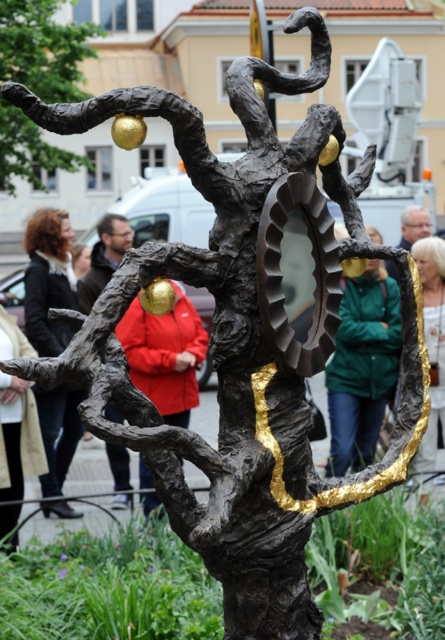
Question: Can you confirm if black leather jacket at left is thinner than gold polished sphere at center?

Choices:
 (A) no
 (B) yes

Answer: (A)

Question: Is golden metallic hair at upper right further to camera compared to gold metallic sphere at upper center?

Choices:
 (A) no
 (B) yes

Answer: (B)

Question: Which object is closer to the camera taking this photo?

Choices:
 (A) bronze textured tree at upper left
 (B) gold metallic sphere at upper center

Answer: (B)

Question: Does golden metallic hair at upper right have a larger size compared to gold polished sphere at center?

Choices:
 (A) no
 (B) yes

Answer: (B)

Question: Which point is farther from the camera taking this photo?

Choices:
 (A) (372, 372)
 (B) (31, 180)
 (C) (161, 282)

Answer: (B)

Question: Which object is closer to the camera taking this photo?

Choices:
 (A) black leather jacket at left
 (B) green matte jacket at center
 (C) gold metallic sphere at upper center
 (D) bronze textured tree at upper left

Answer: (C)